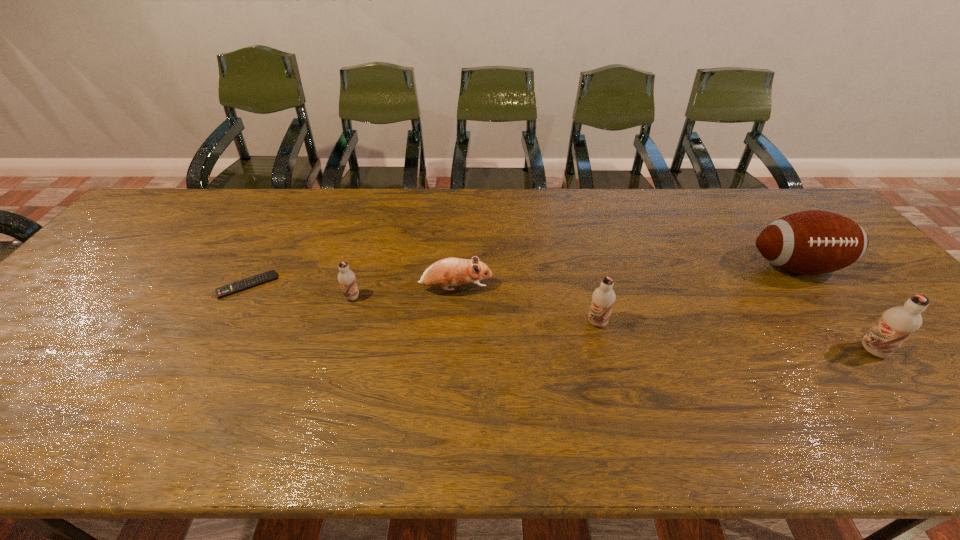
With all chocolate milks evenly spaced, where should an extra chocolate milk be placed on the left to continue the pattern? Please point out a vacant space. Please provide its 2D coordinates. Your answer should be formatted as a tuple, i.e. [(x, y)], where the tuple contains the x and y coordinates of a point satisfying the conditions above.

[(132, 275)]